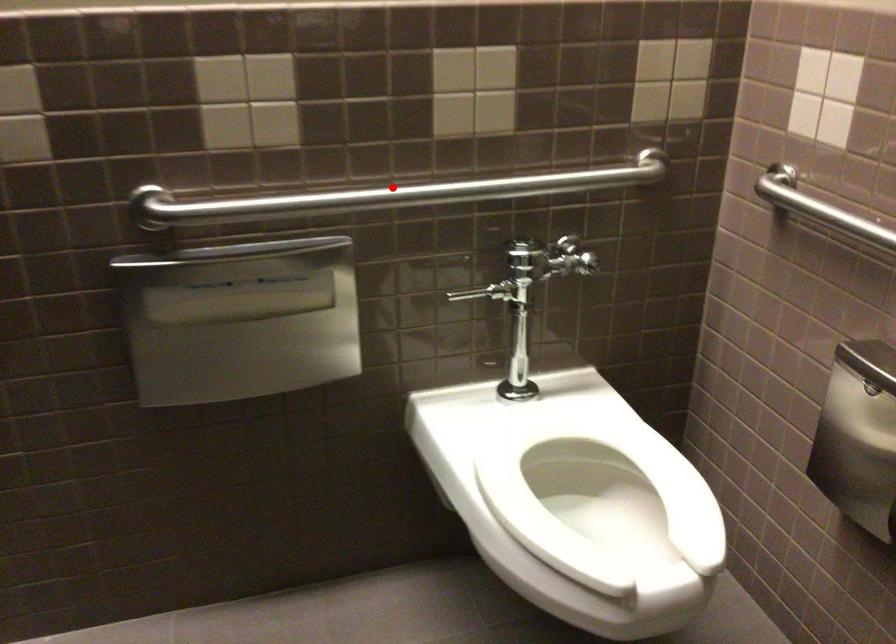
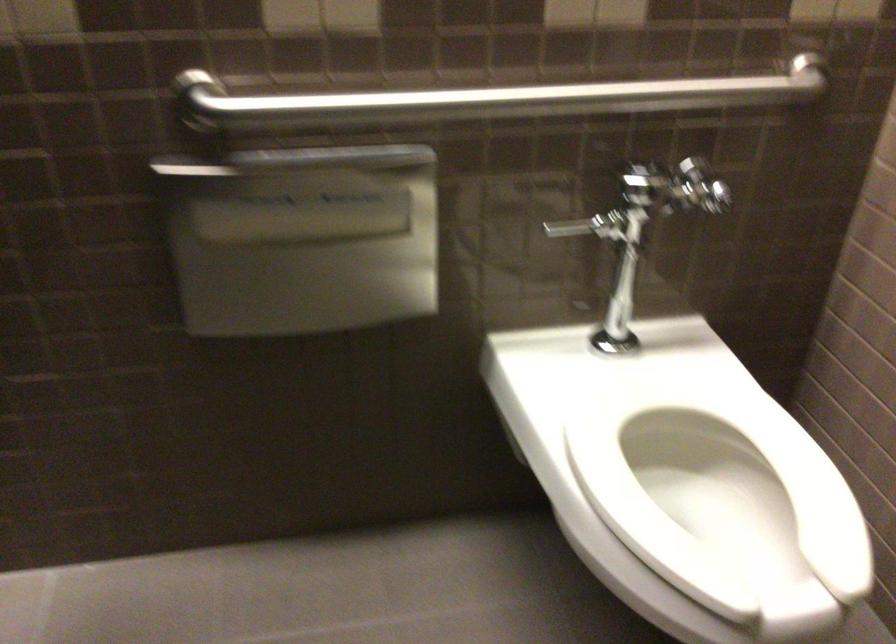
Where in the second image is the point corresponding to the highlighted location from the first image?

(488, 100)